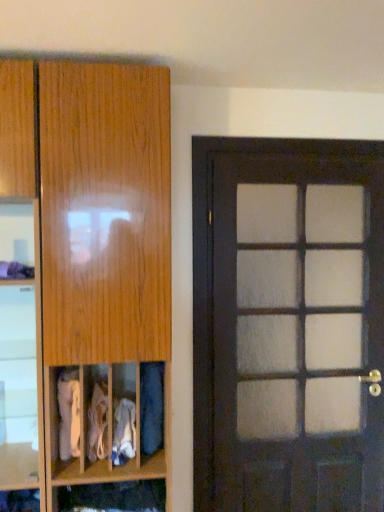
Question: Can we say dark wood door at right lies outside white fabric at lower left, which is the 4th clothing from right to left?

Choices:
 (A) yes
 (B) no

Answer: (A)

Question: Is dark wood door at right aimed at white fabric at lower left, which is the 4th clothing from right to left?

Choices:
 (A) no
 (B) yes

Answer: (A)

Question: From a real-world perspective, is dark wood door at right on top of white fabric at lower left, which is the 4th clothing from right to left?

Choices:
 (A) yes
 (B) no

Answer: (A)

Question: From a real-world perspective, does dark wood door at right sit lower than white fabric at lower left, which is the 4th clothing from right to left?

Choices:
 (A) no
 (B) yes

Answer: (A)

Question: Is dark wood door at right to the right of white fabric at lower left, which is the 4th clothing from right to left, from the viewer's perspective?

Choices:
 (A) no
 (B) yes

Answer: (B)

Question: Can you confirm if dark wood door at right is wider than white fabric at lower left, which is the 4th clothing from right to left?

Choices:
 (A) no
 (B) yes

Answer: (A)

Question: Is wooden cabinet at lower center to the left of wooden cabinet at left from the viewer's perspective?

Choices:
 (A) yes
 (B) no

Answer: (B)

Question: From the image's perspective, does wooden cabinet at lower center appear higher than wooden cabinet at left?

Choices:
 (A) no
 (B) yes

Answer: (A)

Question: Does wooden cabinet at lower center have a greater width compared to wooden cabinet at left?

Choices:
 (A) yes
 (B) no

Answer: (B)

Question: Is wooden cabinet at lower center smaller than wooden cabinet at left?

Choices:
 (A) no
 (B) yes

Answer: (B)

Question: Is wooden cabinet at lower center taller than wooden cabinet at left?

Choices:
 (A) yes
 (B) no

Answer: (B)

Question: Can you confirm if wooden cabinet at lower center is shorter than wooden cabinet at left?

Choices:
 (A) yes
 (B) no

Answer: (A)

Question: Is wooden cabinet at lower center thinner than white fabric at center, arranged as the 3th clothing when viewed from the left?

Choices:
 (A) no
 (B) yes

Answer: (B)